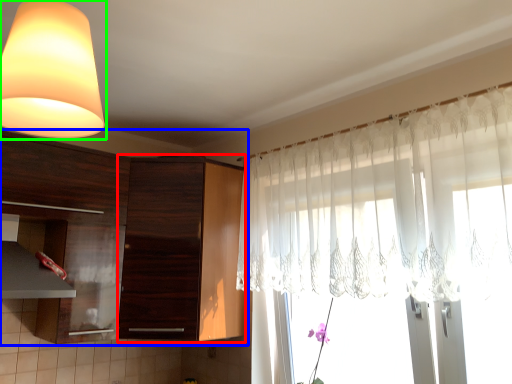
Question: Based on their relative distances, which object is farther from cabinetry (highlighted by a red box)? Choose from cabinetry (highlighted by a blue box) and lamp (highlighted by a green box).

Choices:
 (A) cabinetry
 (B) lamp

Answer: (B)